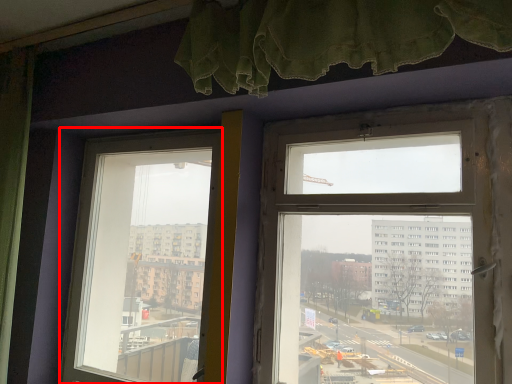
Question: Where is window (annotated by the red box) located in relation to window in the image?

Choices:
 (A) left
 (B) right

Answer: (A)